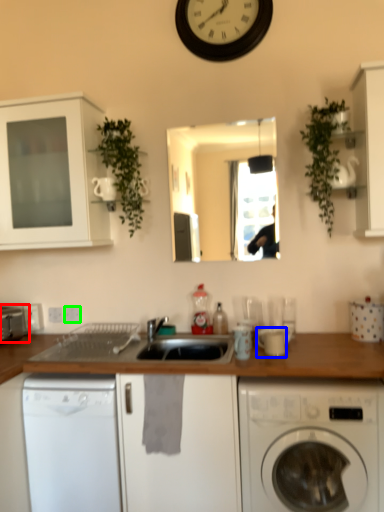
Question: Which object is positioned closest to appliance (highlighted by a red box)? Select from appliance (highlighted by a blue box) and electric outlet (highlighted by a green box).

Choices:
 (A) appliance
 (B) electric outlet

Answer: (B)